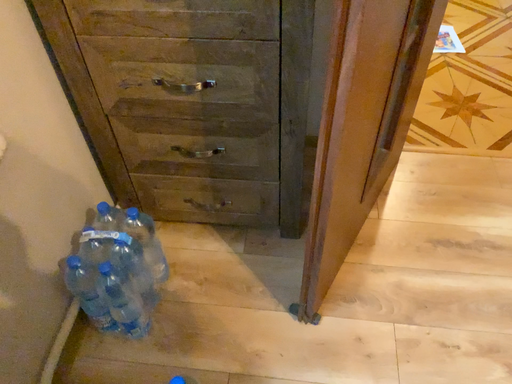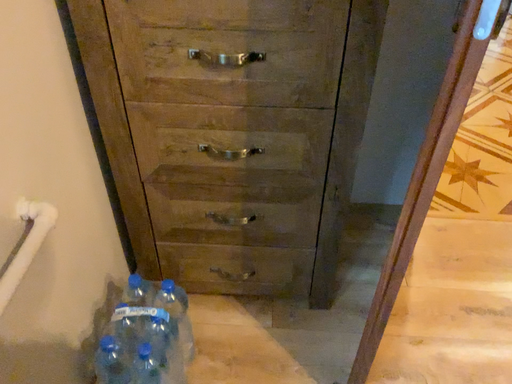
Question: How did the camera likely rotate when shooting the video?

Choices:
 (A) rotated downward
 (B) rotated upward

Answer: (B)